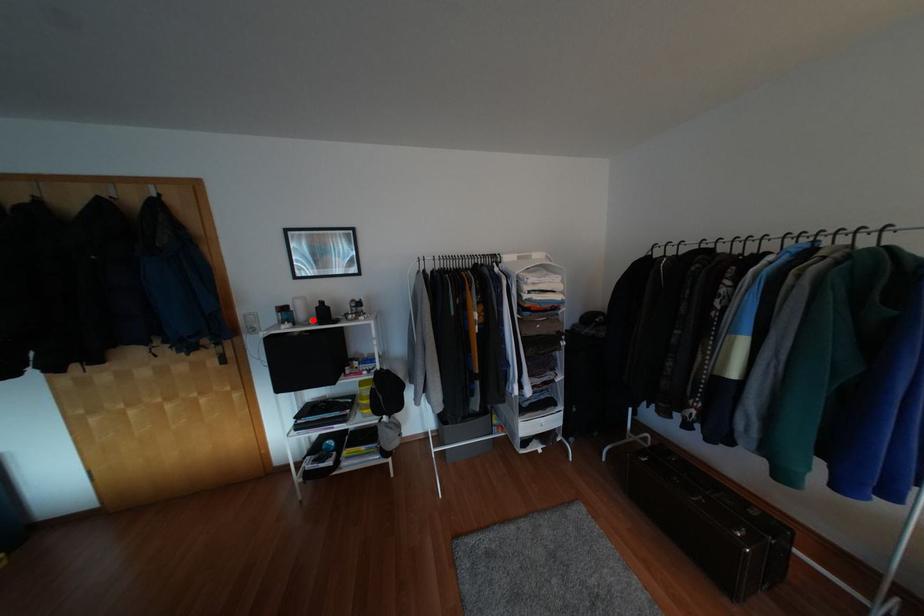
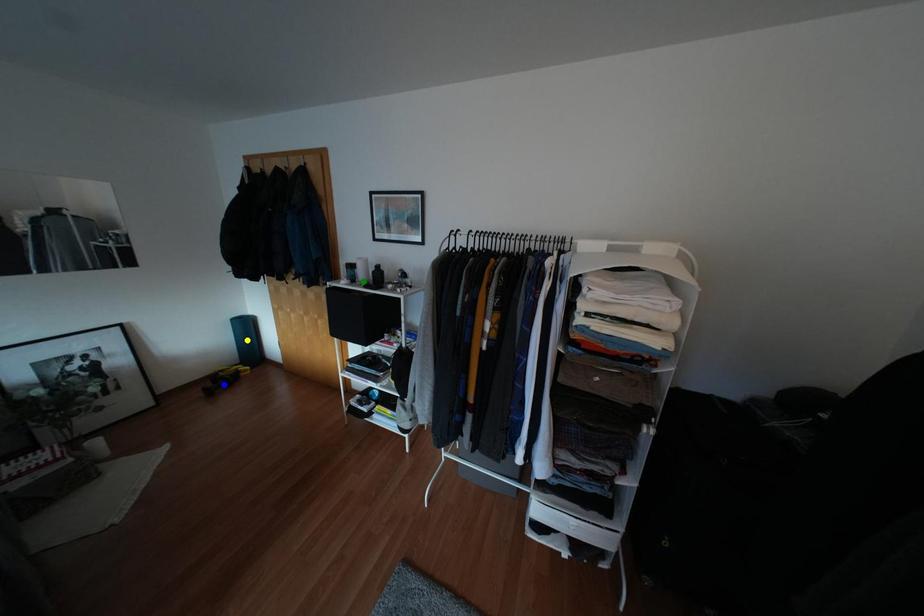
Question: I am providing you with two images of the same scene from different viewpoints. A red point is marked on the first image. You are given multiple points on the second image. Which spot in image 2 lines up with the point in image 1?

Choices:
 (A) yellow point
 (B) blue point
 (C) green point

Answer: (C)